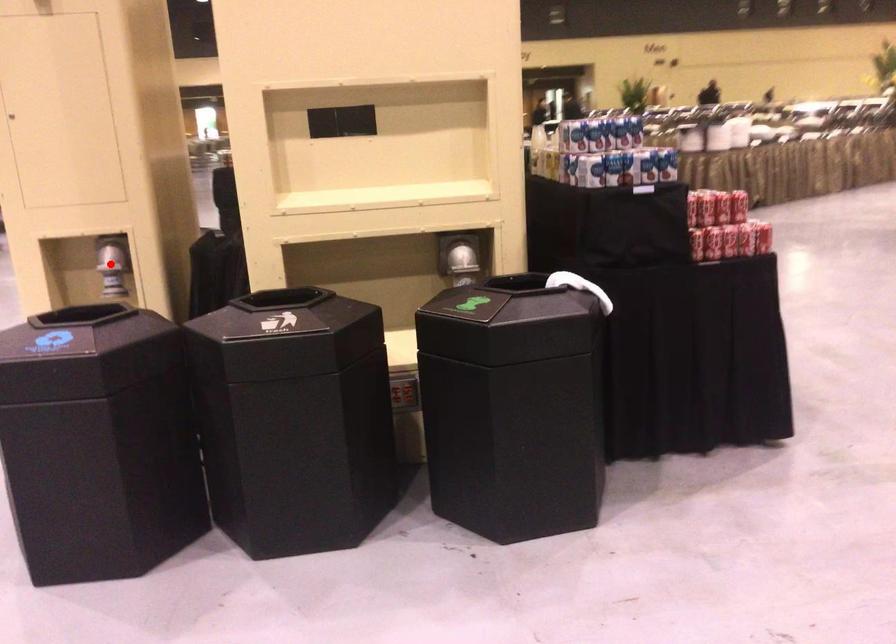
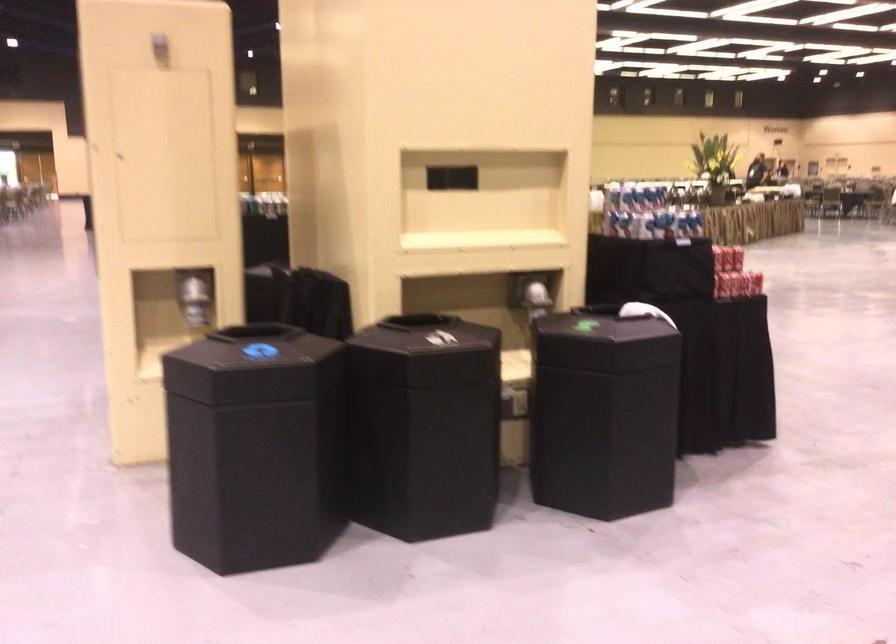
The point at the highlighted location is marked in the first image. Where is the corresponding point in the second image?

(194, 297)